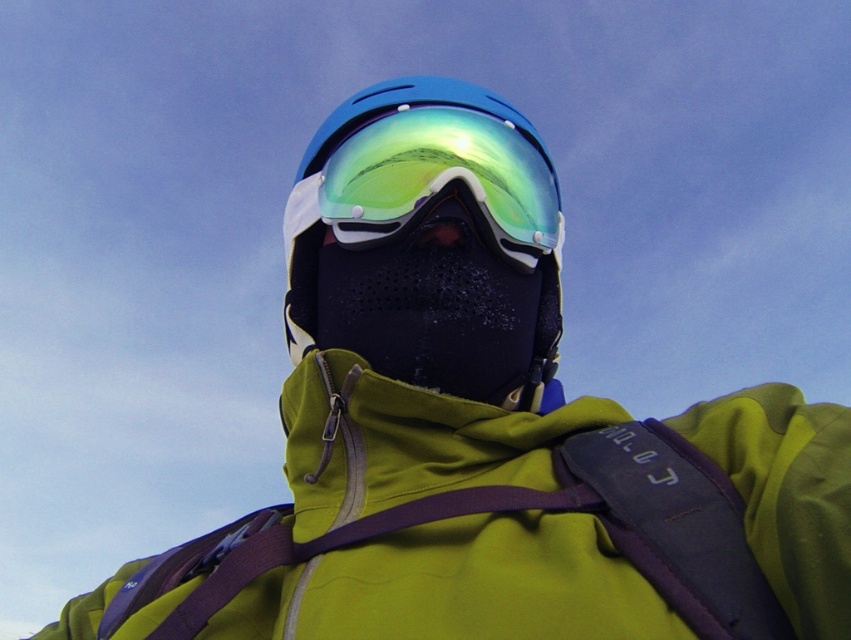
You are a safety inspector checking equipment placement on a winter athlete. The blue matte helmet at center and green reflective lens at center must be positioned correctly. According to safety guidelines, which object is placed higher?

The green reflective lens at center is placed higher than the blue matte helmet at center.

From the picture: You are a photographer taking a portrait of the person wearing the blue matte helmet at center and green reflective lens at center. Which object should you focus on first if you want to ensure the closer one is sharp?

The blue matte helmet at center is closer to the viewer than the green reflective lens at center, so you should focus on the blue matte helmet at center first to ensure it is sharp.

You are a safety inspector checking the equipment of a winter sports athlete. You notice the blue matte helmet at center and the green reflective lens at center. Which piece of equipment is narrower in width?

The blue matte helmet at center is thinner than the green reflective lens at center, so the blue matte helmet at center is narrower in width.